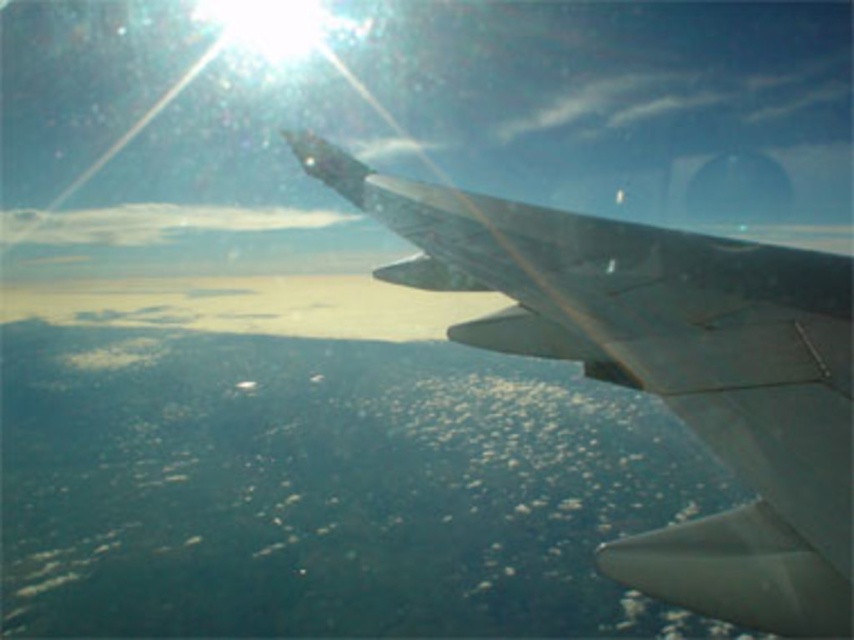
You are a passenger on an airplane and notice two objects outside the window. One is the metallic gray wing at upper right and the other is the white fluffy cloud at upper left. Which object is positioned lower in the scene?

The metallic gray wing at upper right is located below the white fluffy cloud at upper left, so the wing is lower than the cloud.

You are a passenger on an airplane and looking out the window. You see the metallic gray wing at upper right and the white fluffy cloud at upper left. Which object appears larger in the view?

The white fluffy cloud at upper left appears larger than the metallic gray wing at upper right because the metallic gray wing at upper right has a smaller size compared to the white fluffy cloud at upper left.

You are a passenger seated near the window on an airplane. You notice the metallic gray wing at upper right and the white fluffy cloud at upper left outside. Which object appears taller from your viewpoint?

The white fluffy cloud at upper left appears taller than the metallic gray wing at upper right because the metallic gray wing at upper right has a lesser height compared to the white fluffy cloud at upper left.